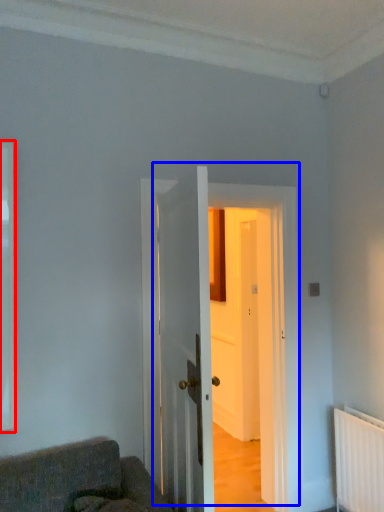
Question: Which of the following is the closest to the observer, window (highlighted by a red box) or door (highlighted by a blue box)?

Choices:
 (A) window
 (B) door

Answer: (A)